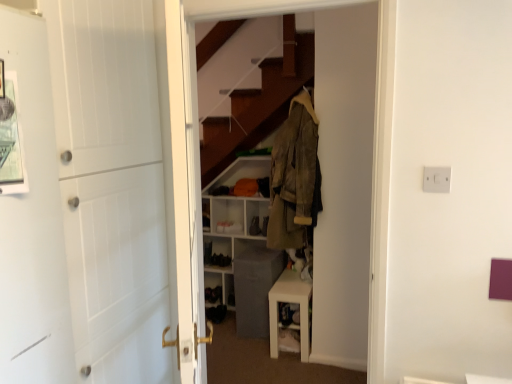
This screenshot has width=512, height=384. Find the location of `white matte table at lower center`. white matte table at lower center is located at coordinates (290, 302).

How much space does black fabric shoe at lower center, the 1th shoe when ordered from bottom to top, occupy horizontally?

black fabric shoe at lower center, the 1th shoe when ordered from bottom to top, is 9.22 inches in width.

Measure the distance between black fabric shoe at lower center, which is the second shoe from right to left, and camera.

black fabric shoe at lower center, which is the second shoe from right to left, and camera are 3.59 meters apart.

The width and height of the screenshot is (512, 384). What do you see at coordinates (207, 252) in the screenshot?
I see `black leather shoe at lower center, which is counted as the first shoe, starting from the left` at bounding box center [207, 252].

Identify the location of metallic silver picture frame at upper left. (11, 141).

Locate an element on the screen. matte black shoe at center, placed as the 3th shoe when sorted from left to right is located at coordinates point(254,226).

Would you say leather-like brown coat at center is a long distance from brown fabric coat at center?

That's not correct — leather-like brown coat at center is a little close to brown fabric coat at center.

From the image's perspective, is leather-like brown coat at center on top of brown fabric coat at center?

Yes, from the image's perspective, leather-like brown coat at center is on top of brown fabric coat at center.

Would you say leather-like brown coat at center is outside brown fabric coat at center?

Yes, leather-like brown coat at center is outside of brown fabric coat at center.

Between leather-like brown coat at center and brown fabric coat at center, which one has smaller size?

Smaller between the two is leather-like brown coat at center.

Where is `picture frame that appears on the left of matte black shoe at center, the 3th shoe positioned from the bottom`? picture frame that appears on the left of matte black shoe at center, the 3th shoe positioned from the bottom is located at coordinates (11, 141).

From the image's perspective, which one is positioned lower, matte black shoe at center, the 3th shoe positioned from the bottom, or metallic silver picture frame at upper left?

From the image's view, matte black shoe at center, the 3th shoe positioned from the bottom, is below.

Identify the location of the 2nd shoe behind when counting from the white matte door at left. (220, 260).

Is black fabric shoe at lower center, which is the second shoe in left-to-right order, far away from white matte door at left?

Yes, black fabric shoe at lower center, which is the second shoe in left-to-right order, and white matte door at left are quite far apart.

Could you tell me if black fabric shoe at lower center, which is the second shoe in left-to-right order, is turned towards white matte door at left?

Yes, black fabric shoe at lower center, which is the second shoe in left-to-right order, is turned towards white matte door at left.

Can you confirm if brown fabric coat at center is taller than metallic silver picture frame at upper left?

Indeed, brown fabric coat at center has a greater height compared to metallic silver picture frame at upper left.

From the image's perspective, is brown fabric coat at center located above metallic silver picture frame at upper left?

Incorrect, from the image's perspective, brown fabric coat at center is lower than metallic silver picture frame at upper left.

Does point (317, 315) come behind point (7, 128)?

Yes.

How many degrees apart are the facing directions of metallic silver picture frame at upper left and black fabric shoe at lower center, which is the second shoe from right to left?

90 degrees separate the facing orientations of metallic silver picture frame at upper left and black fabric shoe at lower center, which is the second shoe from right to left.

Is black fabric shoe at lower center, the third shoe positioned from the top, inside metallic silver picture frame at upper left?

No, black fabric shoe at lower center, the third shoe positioned from the top, is not inside metallic silver picture frame at upper left.

Between point (2, 106) and point (213, 265), which one is positioned in front?

Positioned in front is point (2, 106).

Is matte black shoe at center, placed as the 3th shoe when sorted from left to right, far away from black leather shoe at lower center, marked as the 3th shoe in a right-to-left arrangement?

matte black shoe at center, placed as the 3th shoe when sorted from left to right, is near black leather shoe at lower center, marked as the 3th shoe in a right-to-left arrangement, not far away.

Could you tell me if matte black shoe at center, placed as the 3th shoe when sorted from left to right, is turned towards black leather shoe at lower center, marked as the 3th shoe in a right-to-left arrangement?

No, matte black shoe at center, placed as the 3th shoe when sorted from left to right, is not aimed at black leather shoe at lower center, marked as the 3th shoe in a right-to-left arrangement.

Between matte black shoe at center, the first shoe from the right, and black leather shoe at lower center, the second shoe positioned from the bottom, which one has smaller width?

matte black shoe at center, the first shoe from the right, is thinner.

From the image's perspective, which is above, matte black shoe at center, placed as the 3th shoe when sorted from left to right, or black leather shoe at lower center, the second shoe positioned from the bottom?

matte black shoe at center, placed as the 3th shoe when sorted from left to right.

Is brown fabric coat at center completely or partially outside of black leather shoe at lower center, which is counted as the first shoe, starting from the left?

Indeed, brown fabric coat at center is completely outside black leather shoe at lower center, which is counted as the first shoe, starting from the left.

Considering the sizes of brown fabric coat at center and black leather shoe at lower center, the second shoe positioned from the bottom, in the image, is brown fabric coat at center taller or shorter than black leather shoe at lower center, the second shoe positioned from the bottom,?

In the image, brown fabric coat at center appears to be taller than black leather shoe at lower center, the second shoe positioned from the bottom.

Is black leather shoe at lower center, the second shoe positioned from the bottom, at the back of brown fabric coat at center?

No, brown fabric coat at center's orientation is not away from black leather shoe at lower center, the second shoe positioned from the bottom.

Who is more distant, brown fabric coat at center or black leather shoe at lower center, the second shoe positioned from the bottom?

black leather shoe at lower center, the second shoe positioned from the bottom, is further from the camera.

Find the location of a particular element. This screenshot has height=384, width=512. closet that appears below the leather-like brown coat at center (from the image's perspective) is located at coordinates (346, 181).

You are a GUI agent. You are given a task and a screenshot of the screen. Output one action in this format:
    pyautogui.click(x=<x>, y=<y>)
    Task: Click on the picture frame located in front of the matte black shoe at center, which is the 1th shoe in top-to-bottom order
    The height and width of the screenshot is (384, 512).
    Given the screenshot: What is the action you would take?
    pyautogui.click(x=11, y=141)

When comparing their distances from black fabric shoe at lower center, the 1th shoe when ordered from bottom to top, does black leather shoe at lower center, marked as the 3th shoe in a right-to-left arrangement, or white matte table at lower center seem closer?

black leather shoe at lower center, marked as the 3th shoe in a right-to-left arrangement, lies closer to black fabric shoe at lower center, the 1th shoe when ordered from bottom to top, than the other object.

Based on their spatial positions, is brown fabric coat at center or black fabric shoe at lower center, which is the second shoe from right to left, further from black leather shoe at lower center, marked as the 3th shoe in a right-to-left arrangement?

The object further to black leather shoe at lower center, marked as the 3th shoe in a right-to-left arrangement, is brown fabric coat at center.

Looking at the image, which one is located closer to matte black shoe at center, the first shoe from the right, black leather shoe at lower center, which is counted as the first shoe, starting from the left, or leather-like brown coat at center?

Based on the image, black leather shoe at lower center, which is counted as the first shoe, starting from the left, appears to be nearer to matte black shoe at center, the first shoe from the right.

Which object lies nearer to the anchor point black fabric shoe at lower center, the third shoe positioned from the top, brown fabric coat at center or matte black shoe at center, placed as the 3th shoe when sorted from left to right?

matte black shoe at center, placed as the 3th shoe when sorted from left to right, lies closer to black fabric shoe at lower center, the third shoe positioned from the top, than the other object.

Based on their spatial positions, is white matte door at left or metallic silver picture frame at upper left closer to brown fabric coat at center?

white matte door at left is closer to brown fabric coat at center.

When comparing their distances from black leather shoe at lower center, the second shoe positioned from the bottom, does black fabric shoe at lower center, which is the second shoe in left-to-right order, or matte black shoe at center, the 3th shoe positioned from the bottom, seem further?

matte black shoe at center, the 3th shoe positioned from the bottom, lies further to black leather shoe at lower center, the second shoe positioned from the bottom, than the other object.

From the image, which object appears to be farther from black fabric shoe at lower center, the 1th shoe when ordered from bottom to top, white matte table at lower center or brown fabric coat at center?

brown fabric coat at center is positioned further to the anchor black fabric shoe at lower center, the 1th shoe when ordered from bottom to top.

Based on their spatial positions, is black leather shoe at lower center, the second shoe positioned from the bottom, or brown fabric coat at center further from white matte table at lower center?

Among the two, black leather shoe at lower center, the second shoe positioned from the bottom, is located further to white matte table at lower center.

The width and height of the screenshot is (512, 384). In order to click on clothing between metallic silver picture frame at upper left and black fabric shoe at lower center, the 1th shoe when ordered from bottom to top, along the z-axis in this screenshot , I will do `click(294, 177)`.

Identify the location of closet between white matte door at left and leather-like brown coat at center from front to back. (346, 181).

You are a GUI agent. You are given a task and a screenshot of the screen. Output one action in this format:
    pyautogui.click(x=<x>, y=<y>)
    Task: Click on the clothing positioned between white matte door at left and black fabric shoe at lower center, which is the second shoe from right to left, from near to far
    The image size is (512, 384).
    Given the screenshot: What is the action you would take?
    pyautogui.click(x=294, y=177)

The height and width of the screenshot is (384, 512). Find the location of `table located between brown fabric coat at center and black fabric shoe at lower center, which is the second shoe in left-to-right order, in the depth direction`. table located between brown fabric coat at center and black fabric shoe at lower center, which is the second shoe in left-to-right order, in the depth direction is located at coordinates (290, 302).